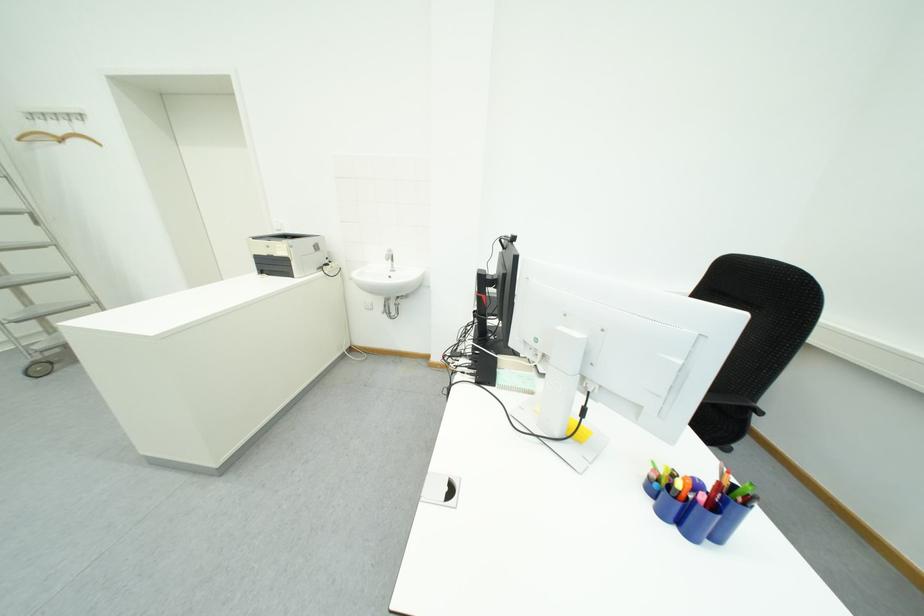
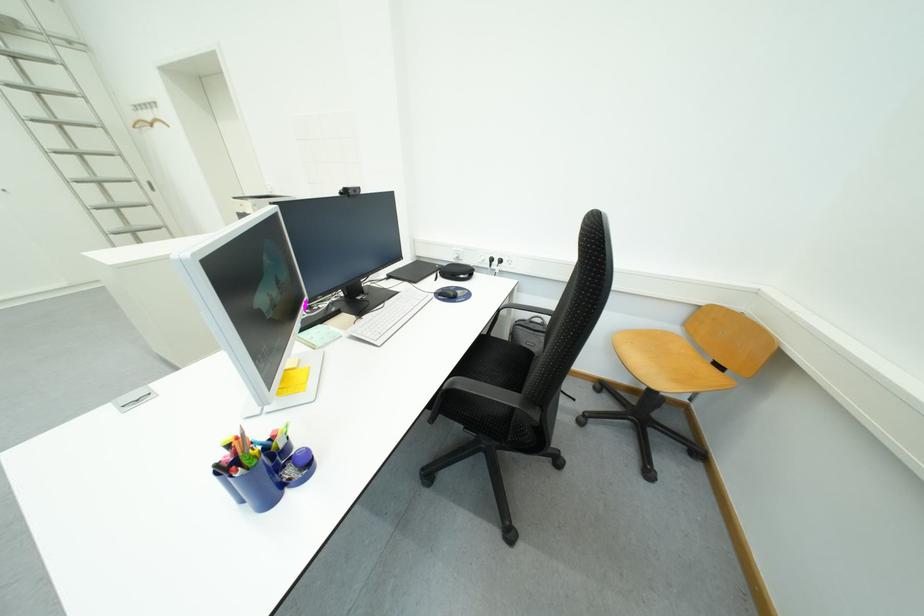
Question: The images are taken continuously from a first-person perspective. In which direction are you moving?

Choices:
 (A) Left
 (B) Right
 (C) Forward
 (D) Backward

Answer: (B)